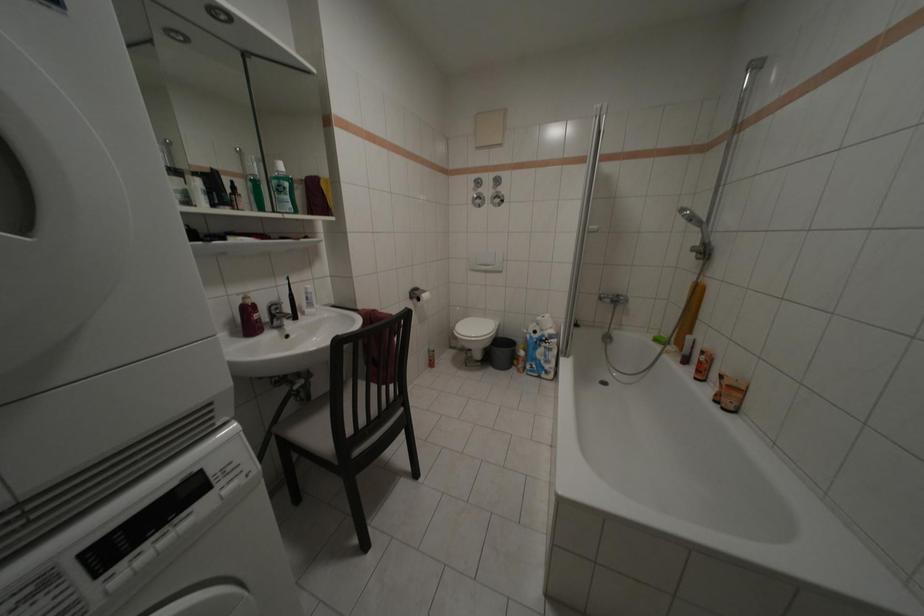
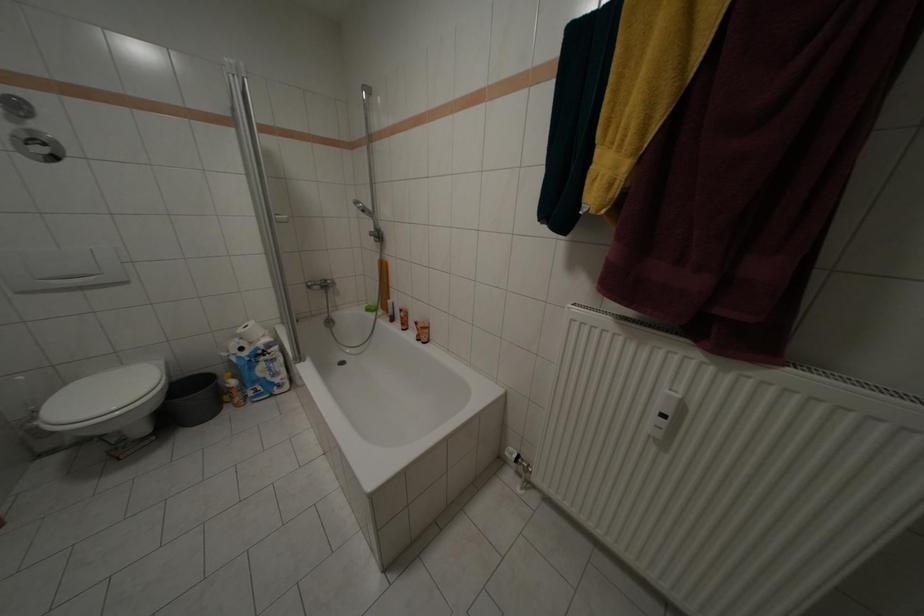
Question: The camera is either moving clockwise (left) or counter-clockwise (right) around the object. The first image is from the beginning of the video and the second image is from the end. Is the camera moving left or right when shooting the video?

Choices:
 (A) Left
 (B) Right

Answer: (A)